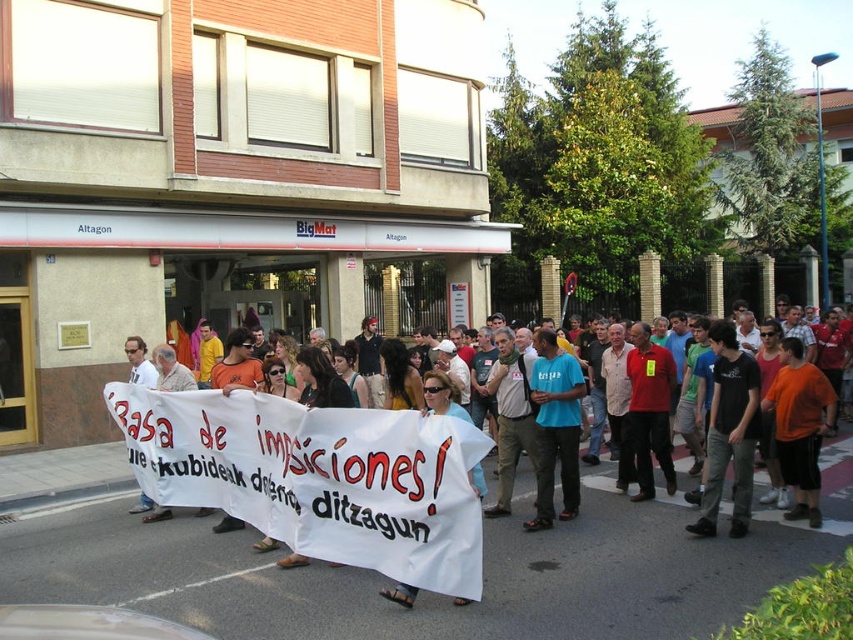
Question: Which of the following is the farthest from the observer?

Choices:
 (A) click(x=805, y=380)
 (B) click(x=738, y=492)

Answer: (A)

Question: In this image, where is white fabric banner at center located relative to dark blue t-shirt at center?

Choices:
 (A) left
 (B) right

Answer: (A)

Question: Is the position of white fabric banner at center more distant than that of dark blue t-shirt at center?

Choices:
 (A) yes
 (B) no

Answer: (B)

Question: Can you confirm if white fabric banner at center is wider than blue t-shirt at center?

Choices:
 (A) no
 (B) yes

Answer: (B)

Question: Which object is the closest to the dark blue t-shirt at center?

Choices:
 (A) blue t-shirt at center
 (B) orange cotton shirt at center
 (C) white fabric banner at center

Answer: (B)

Question: Which object is positioned closest to the white fabric banner at center?

Choices:
 (A) blue t-shirt at center
 (B) dark blue t-shirt at center

Answer: (A)